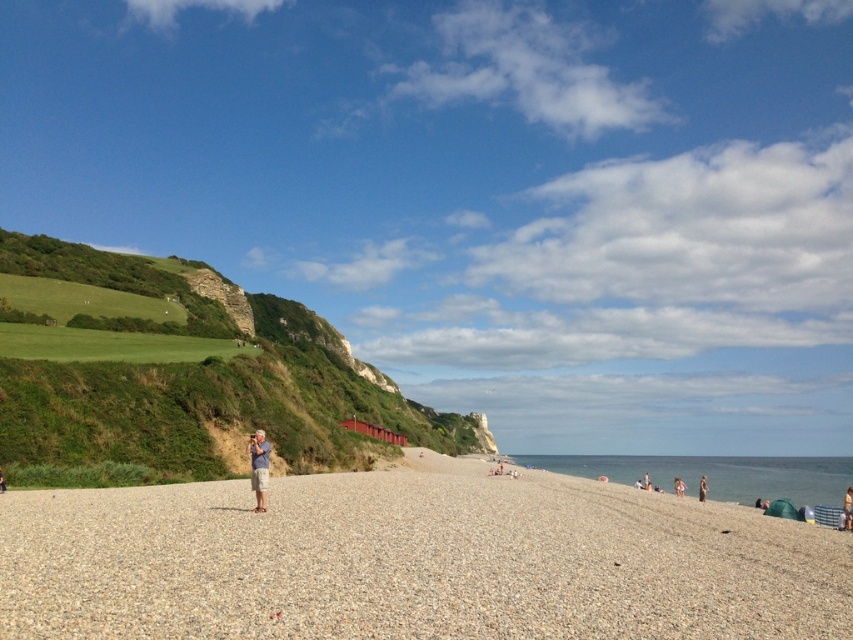
Is point (169, 276) less distant than point (675, 492)?

No.

Does green grassy hillside at left lie behind pink fabric at lower right?

No, it is in front of pink fabric at lower right.

Is point (206, 390) closer to camera compared to point (682, 483)?

Yes, it is in front of point (682, 483).

Where is `green grassy hillside at left`? green grassy hillside at left is located at coordinates (181, 374).

Does smooth gravel beach at center have a greater width compared to light brown sand at lower right?

Correct, the width of smooth gravel beach at center exceeds that of light brown sand at lower right.

Which is behind, point (250, 577) or point (645, 486)?

Point (645, 486)

You are a GUI agent. You are given a task and a screenshot of the screen. Output one action in this format:
    pyautogui.click(x=<x>, y=<y>)
    Task: Click on the smooth gravel beach at center
    The height and width of the screenshot is (640, 853).
    Given the screenshot: What is the action you would take?
    pyautogui.click(x=413, y=561)

Which is below, smooth gravel beach at center or pink fabric at lower right?

Positioned lower is pink fabric at lower right.

Who is shorter, smooth gravel beach at center or pink fabric at lower right?

smooth gravel beach at center is shorter.

Does point (688, 620) come behind point (682, 492)?

No, it is in front of (682, 492).

At what (x,y) coordinates should I click in order to perform the action: click on smooth gravel beach at center. Please return your answer as a coordinate pair (x, y). The image size is (853, 640). Looking at the image, I should click on (413, 561).